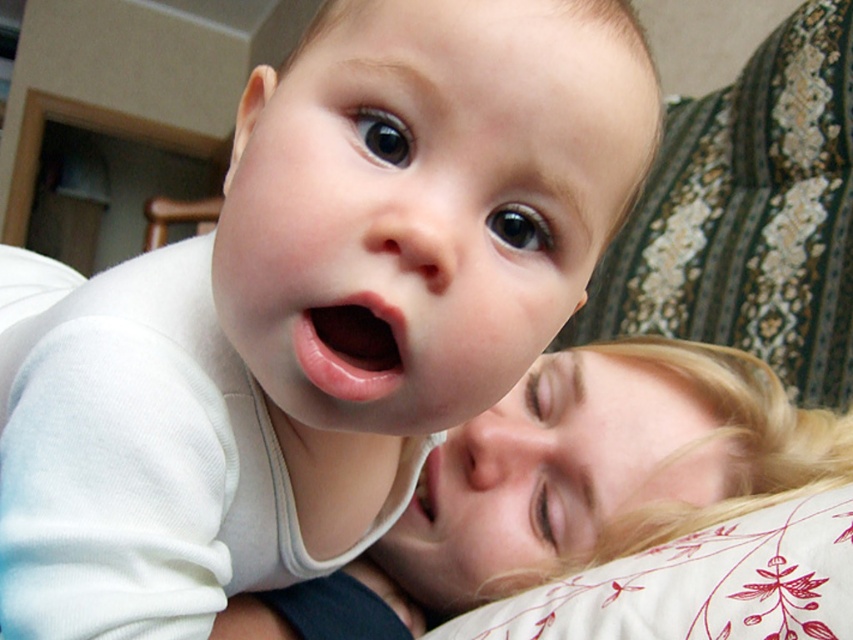
You are taking a photo of two points in the image. The first point is at coordinate point (744, 353) and the second is at point (838, 588). Which point is closer to the camera?

Point (744, 353) is closer to the camera than point (838, 588) because it is further to the camera than the latter according to the description.

From the picture: You are a photographer setting up for a family portrait. You notice the smooth blonde hair at upper center and the white floral pillow at lower right. Which object is located above the other?

The smooth blonde hair at upper center is positioned over the white floral pillow at lower right, so it is above it.

From the picture: You are a photographer adjusting the lighting in the room. You need to ensure that the smooth blonde hair at upper center and the white floral pillow at lower right are both well lit. Given their distance apart, do you think you can adjust the lighting so that both are illuminated evenly without moving any of them?

The distance between the smooth blonde hair at upper center and the white floral pillow at lower right is 4.89 inches, which is relatively close. Therefore, adjusting the lighting to evenly illuminate both should be feasible without moving them.